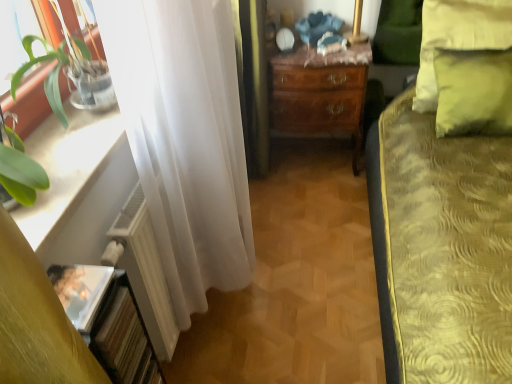
Identify the location of vacant space situated above white glossy window sill at left (from a real-world perspective). The image size is (512, 384). (69, 149).